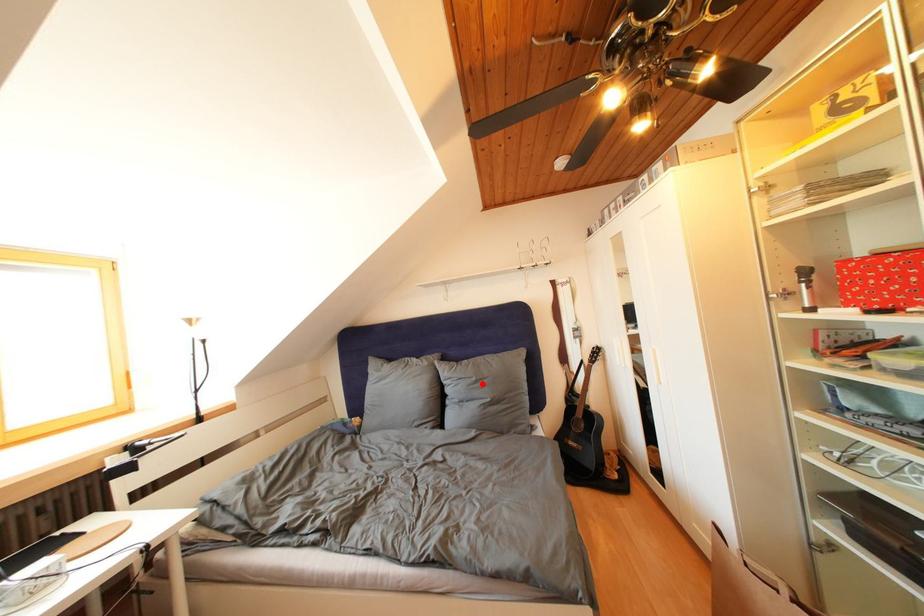
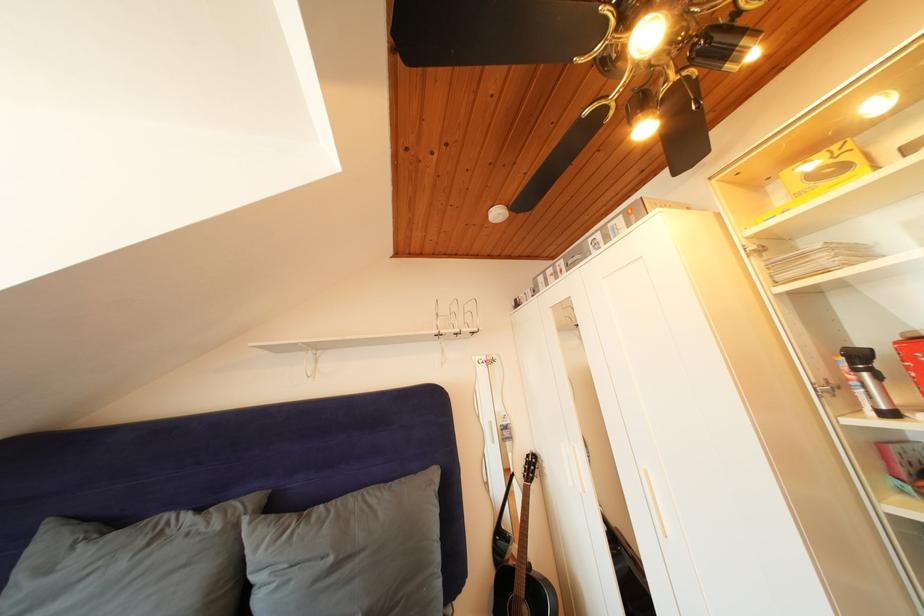
Question: I am providing you with two images of the same scene from different viewpoints. Given a red point in image1, look at the same physical point in image2. Is it:

Choices:
 (A) Closer to the viewpoint
 (B) Farther from the viewpoint

Answer: (A)